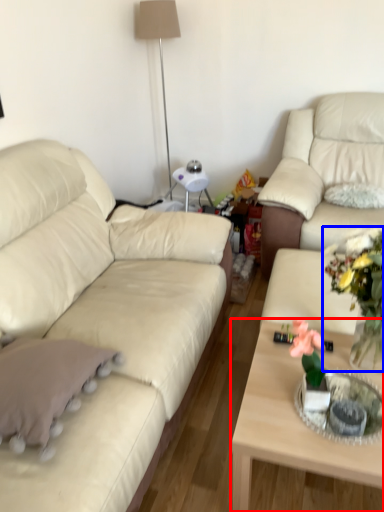
Question: Among these objects, which one is nearest to the camera, coffee table (highlighted by a red box) or floral arrangement (highlighted by a blue box)?

Choices:
 (A) coffee table
 (B) floral arrangement

Answer: (B)